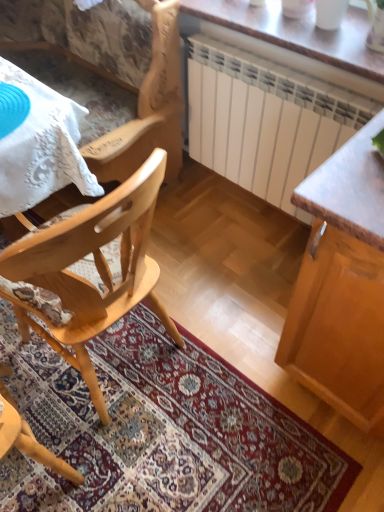
Find the location of a particular element. This screenshot has width=384, height=512. vacant space positioned to the left of wooden cabinet at right is located at coordinates (231, 306).